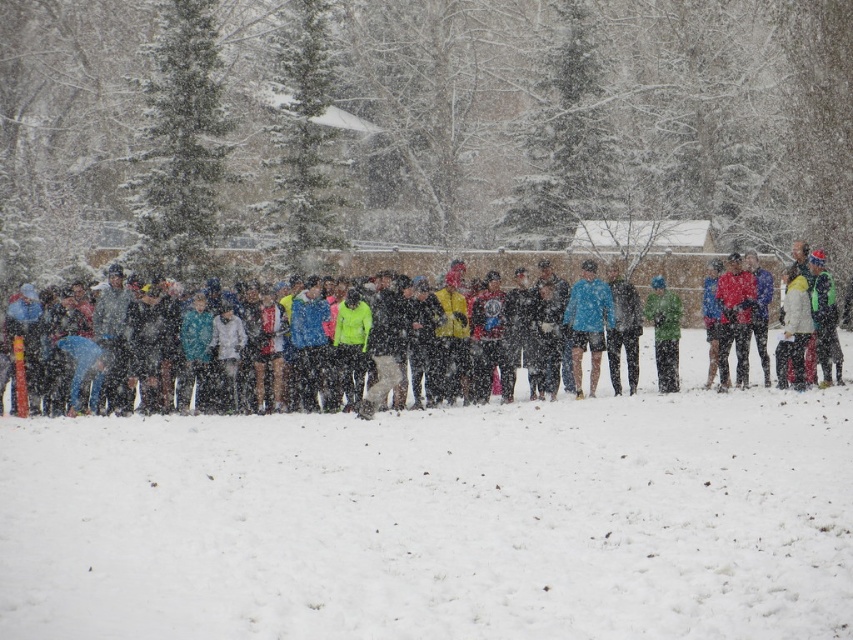
Can you confirm if white fluffy snow at lower center is shorter than blue matte jacket at center?

Correct, white fluffy snow at lower center is not as tall as blue matte jacket at center.

Is point (312, 499) positioned after point (596, 292)?

No, (312, 499) is closer to viewer.

At what (x,y) coordinates should I click in order to perform the action: click on white fluffy snow at lower center. Please return your answer as a coordinate pair (x, y). The image size is (853, 640). Looking at the image, I should click on (436, 522).

Who is lower down, multicolored jackets at center or matte red jacket at right?

matte red jacket at right is lower down.

Which of these two, multicolored jackets at center or matte red jacket at right, stands taller?

multicolored jackets at center

Is point (572, 260) less distant than point (730, 300)?

No.

This screenshot has width=853, height=640. Find the location of `multicolored jackets at center`. multicolored jackets at center is located at coordinates (676, 282).

Does point (584, 291) lie in front of point (670, 333)?

Yes, it is in front of point (670, 333).

Based on the photo, is blue matte jacket at center taller than green fabric jacket at center?

Yes, blue matte jacket at center is taller than green fabric jacket at center.

Where is `blue matte jacket at center`? blue matte jacket at center is located at coordinates (589, 323).